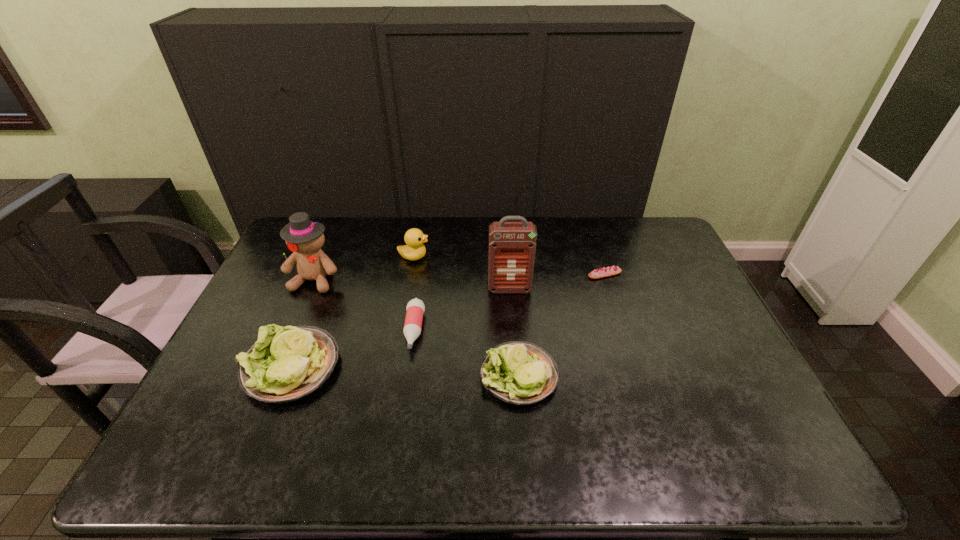
Where is `vacant area in the image that satisfies the following two spatial constraints: 1. on the back side of the third shortest object; 2. on the face of the farthest object`? This screenshot has height=540, width=960. vacant area in the image that satisfies the following two spatial constraints: 1. on the back side of the third shortest object; 2. on the face of the farthest object is located at coordinates (509, 256).

The height and width of the screenshot is (540, 960). Identify the location of vacant space that satisfies the following two spatial constraints: 1. on the front side of the left lettuce; 2. on the left side of the shorter lettuce. (287, 375).

At what (x,y) coordinates should I click in order to perform the action: click on free space that satisfies the following two spatial constraints: 1. with the cap open on the second shortest object; 2. on the left side of the shorter lettuce. Please return your answer as a coordinate pair (x, y). The height and width of the screenshot is (540, 960). Looking at the image, I should click on (407, 375).

Where is `vacant region that satisfies the following two spatial constraints: 1. on the back side of the shortest object; 2. on the left side of the fourth tallest object`? This screenshot has width=960, height=540. vacant region that satisfies the following two spatial constraints: 1. on the back side of the shortest object; 2. on the left side of the fourth tallest object is located at coordinates (327, 274).